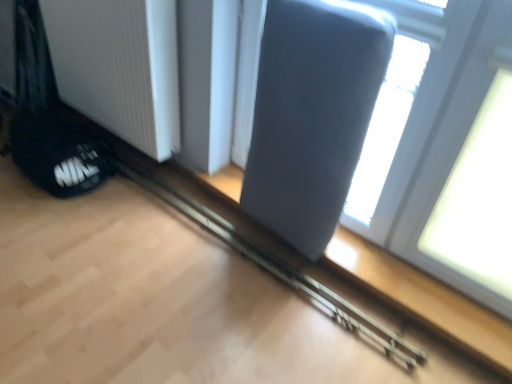
Image resolution: width=512 pixels, height=384 pixels. In order to click on vacant space in front of metallic gray rail at center in this screenshot , I will do `click(213, 311)`.